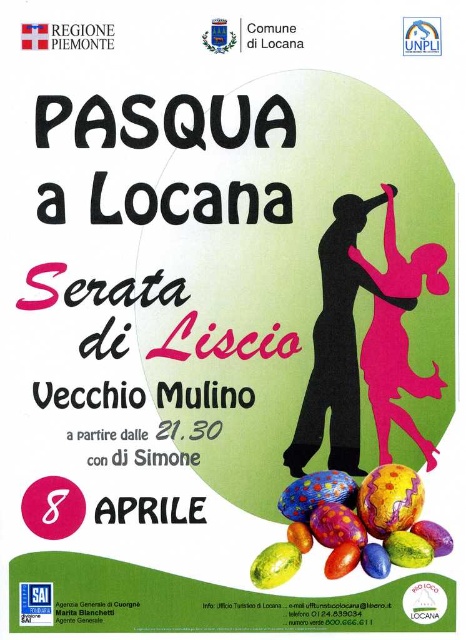
You are an event planner organizing the Easter at Locana event. You need to place a decorative banner between the multicolored glossy easter egg at lower right and the matte yellow easter egg at lower center. Based on their positions, where should the banner be placed?

The multicolored glossy easter egg at lower right is above the matte yellow easter egg at lower center, so the banner should be placed below the multicolored glossy easter egg at lower right and above the matte yellow easter egg at lower center to position it between them.

From the picture: You are designing a promotional poster and need to ensure proper spacing between the black matte figure at center and the matte yellow easter egg at lower center. According to the design specifications, the minimum required distance between these two elements should be 10 inches. Can the current placement meet this requirement?

The black matte figure at center is 12.92 inches from the matte yellow easter egg at lower center, which exceeds the minimum required distance of 10 inches. Therefore, the current placement meets the requirement.